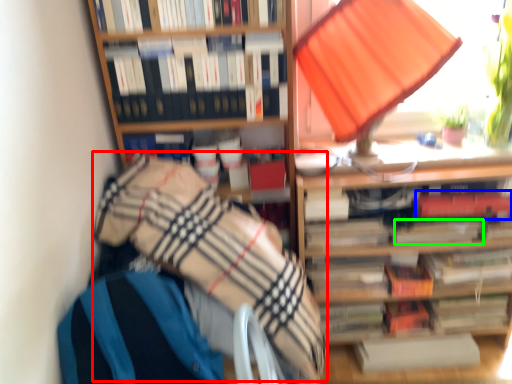
Question: Based on their relative distances, which object is nearer to blanket (highlighted by a red box)? Choose from paperback book (highlighted by a blue box) and paperback book (highlighted by a green box).

Choices:
 (A) paperback book
 (B) paperback book

Answer: (B)